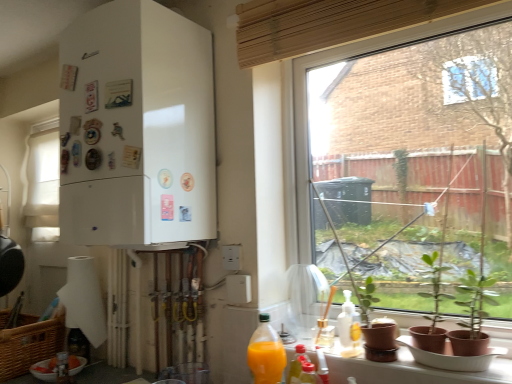
You are a GUI agent. You are given a task and a screenshot of the screen. Output one action in this format:
    pyautogui.click(x=<x>, y=<y>)
    Task: Click on the transparent glass window at center, which is counted as the first window, starting from the right
    
    Given the screenshot: What is the action you would take?
    pyautogui.click(x=409, y=153)

The image size is (512, 384). In order to click on translucent plastic bottle at lower center, the second bottle in the back-to-front sequence in this screenshot , I will do `click(297, 364)`.

Where is `white matte refrigerator at left`? This screenshot has height=384, width=512. white matte refrigerator at left is located at coordinates (136, 128).

The width and height of the screenshot is (512, 384). I want to click on matte brown pots at lower right, so click(411, 371).

Is white fabric curtain at left, which is the 2th window in front-to-back order, taller than transparent glass window at center, the 2th window in the back-to-front sequence?

In fact, white fabric curtain at left, which is the 2th window in front-to-back order, may be shorter than transparent glass window at center, the 2th window in the back-to-front sequence.

Is white fabric curtain at left, the 2th window when ordered from right to left, turned away from transparent glass window at center, the 2th window in the back-to-front sequence?

white fabric curtain at left, the 2th window when ordered from right to left, does not have its back to transparent glass window at center, the 2th window in the back-to-front sequence.

Which object is positioned more to the right, white fabric curtain at left, the 2th window when ordered from right to left, or transparent glass window at center, the 2th window in the back-to-front sequence?

transparent glass window at center, the 2th window in the back-to-front sequence, is more to the right.

In the image, is green matte plant at lower right positioned in front of or behind translucent plastic bottle at lower center, the 3th bottle in the left-to-right sequence?

green matte plant at lower right is in front of translucent plastic bottle at lower center, the 3th bottle in the left-to-right sequence.

Consider the image. Can you confirm if green matte plant at lower right is positioned to the left of translucent plastic bottle at lower center, the third bottle positioned from the front?

No.

Does green matte plant at lower right have a smaller size compared to translucent plastic bottle at lower center, the second bottle in the back-to-front sequence?

No.

Which is more to the right, translucent plastic bottle at lower center, the third bottle positioned from the front, or transparent glass window at center, which is counted as the first window, starting from the right?

transparent glass window at center, which is counted as the first window, starting from the right, is more to the right.

Based on the photo, from a real-world perspective, between translucent plastic bottle at lower center, the 2th bottle when ordered from right to left, and transparent glass window at center, the 2th window in the back-to-front sequence, who is vertically higher?

transparent glass window at center, the 2th window in the back-to-front sequence, is physically above.

Considering the sizes of objects translucent plastic bottle at lower center, the 2th bottle when ordered from right to left, and transparent glass window at center, the 2th window in the back-to-front sequence, in the image provided, who is taller, translucent plastic bottle at lower center, the 2th bottle when ordered from right to left, or transparent glass window at center, the 2th window in the back-to-front sequence,?

transparent glass window at center, the 2th window in the back-to-front sequence, is taller.

Do you think translucent plastic bottle at lower center, the 2th bottle when ordered from right to left, is within transparent glass window at center, which is counted as the first window, starting from the right, or outside of it?

translucent plastic bottle at lower center, the 2th bottle when ordered from right to left, is located beyond the bounds of transparent glass window at center, which is counted as the first window, starting from the right.

Is point (259, 329) farther from viewer compared to point (69, 381)?

No, it is not.

Which of these two, translucent orange juice at lower right, which is the 2th bottle in left-to-right order, or translucent plastic bottle at lower left, which is counted as the 4th bottle, starting from the front, stands taller?

With more height is translucent orange juice at lower right, which is the 2th bottle in left-to-right order.

Between translucent orange juice at lower right, the third bottle positioned from the right, and translucent plastic bottle at lower left, the 1th bottle positioned from the left, which one has larger size?

Bigger between the two is translucent orange juice at lower right, the third bottle positioned from the right.

How many degrees apart are the facing directions of translucent orange juice at lower right, which is the 2th bottle in left-to-right order, and translucent plastic bottle at lower left, which is counted as the 4th bottle, starting from the front?

The angle between the facing direction of translucent orange juice at lower right, which is the 2th bottle in left-to-right order, and the facing direction of translucent plastic bottle at lower left, which is counted as the 4th bottle, starting from the front, is 86.7 degrees.

Does white matte bowl at lower left contain translucent orange juice at lower right, arranged as the 2th bottle when viewed from the front?

No.

Does point (45, 368) come in front of point (282, 352)?

No.

Is white matte bowl at lower left next to translucent orange juice at lower right, arranged as the 2th bottle when viewed from the front, and touching it?

No, white matte bowl at lower left is not making contact with translucent orange juice at lower right, arranged as the 2th bottle when viewed from the front.

From a real-world perspective, who is located higher, translucent orange juice at lower right, the third bottle positioned from the right, or translucent plastic bottle at lower right, positioned as the 1th bottle in front-to-back order?

From a 3D spatial view, translucent orange juice at lower right, the third bottle positioned from the right, is above.

Is translucent orange juice at lower right, which is the 2th bottle in left-to-right order, far away from translucent plastic bottle at lower right, which appears as the 4th bottle when viewed from the left?

That's not correct — translucent orange juice at lower right, which is the 2th bottle in left-to-right order, is a little close to translucent plastic bottle at lower right, which appears as the 4th bottle when viewed from the left.

From the image's perspective, which object appears higher, translucent orange juice at lower right, which is the 2th bottle in left-to-right order, or translucent plastic bottle at lower right, the 1th bottle when ordered from right to left?

translucent orange juice at lower right, which is the 2th bottle in left-to-right order, is shown above in the image.

Is translucent plastic bottle at lower right, positioned as the 1th bottle in front-to-back order, at the back of translucent orange juice at lower right, arranged as the third bottle when viewed from the back?

Correct, translucent orange juice at lower right, arranged as the third bottle when viewed from the back, is looking away from translucent plastic bottle at lower right, positioned as the 1th bottle in front-to-back order.

Is matte brown pots at lower right to the left or to the right of woven brown picnic basket at lower left in the image?

matte brown pots at lower right is positioned on woven brown picnic basket at lower left's right side.

Can woven brown picnic basket at lower left be found inside matte brown pots at lower right?

No, woven brown picnic basket at lower left is not surrounded by matte brown pots at lower right.

Which object is wider, matte brown pots at lower right or woven brown picnic basket at lower left?

woven brown picnic basket at lower left.

Considering the sizes of matte brown pots at lower right and woven brown picnic basket at lower left in the image, is matte brown pots at lower right taller or shorter than woven brown picnic basket at lower left?

Considering their sizes, matte brown pots at lower right has less height than woven brown picnic basket at lower left.

Find the location of a particular element. window lying above the white fabric curtain at left, which is the 2th window in front-to-back order (from the image's perspective) is located at coordinates (409, 153).

Identify the location of the 2nd bottle counting from the left of the green matte plant at lower right. This screenshot has width=512, height=384. (297, 364).

Which object lies nearer to the anchor point woven brown picnic basket at lower left, white fabric curtain at left, the first window from the left, or green matte plant at lower right?

Among the two, white fabric curtain at left, the first window from the left, is located nearer to woven brown picnic basket at lower left.

Considering their positions, is translucent plastic bottle at lower left, the fourth bottle positioned from the right, positioned further to translucent orange juice at lower right, the third bottle positioned from the right, than white matte bowl at lower left?

The object further to translucent orange juice at lower right, the third bottle positioned from the right, is white matte bowl at lower left.

From the image, which object appears to be farther from transparent glass window at center, which is counted as the 1th window, starting from the front, translucent plastic bottle at lower right, the fourth bottle in the back-to-front sequence, or white matte refrigerator at left?

The object further to transparent glass window at center, which is counted as the 1th window, starting from the front, is translucent plastic bottle at lower right, the fourth bottle in the back-to-front sequence.

Which object lies further to the anchor point translucent plastic bottle at lower center, the 2th bottle when ordered from right to left, matte brown pots at lower right or green matte plant at lower right?

Based on the image, green matte plant at lower right appears to be further to translucent plastic bottle at lower center, the 2th bottle when ordered from right to left.

Which object lies nearer to the anchor point matte brown pots at lower right, translucent orange juice at lower right, the third bottle positioned from the right, or white matte refrigerator at left?

translucent orange juice at lower right, the third bottle positioned from the right, is closer to matte brown pots at lower right.

Consider the image. When comparing their distances from translucent orange juice at lower right, which is the 2th bottle in left-to-right order, does green matte plant at lower right or transparent glass window at center, which is counted as the first window, starting from the right, seem closer?

The object closer to translucent orange juice at lower right, which is the 2th bottle in left-to-right order, is green matte plant at lower right.

In the scene shown: Which object lies nearer to the anchor point transparent glass window at center, the 2th window in the back-to-front sequence, white matte refrigerator at left or matte brown pots at lower right?

matte brown pots at lower right is positioned closer to the anchor transparent glass window at center, the 2th window in the back-to-front sequence.

Which object lies nearer to the anchor point translucent orange juice at lower right, arranged as the 2th bottle when viewed from the front, translucent plastic bottle at lower left, the fourth bottle positioned from the right, or white matte refrigerator at left?

Among the two, white matte refrigerator at left is located nearer to translucent orange juice at lower right, arranged as the 2th bottle when viewed from the front.

Find the location of a particular element. This screenshot has height=384, width=512. window sill between white matte refrigerator at left and transparent glass window at center, the 2th window in the back-to-front sequence is located at coordinates click(411, 371).

Where is `houseplant between white matte refrigerator at left and matte brown pots at lower right from left to right`? The height and width of the screenshot is (384, 512). houseplant between white matte refrigerator at left and matte brown pots at lower right from left to right is located at coordinates (376, 328).

This screenshot has width=512, height=384. Identify the location of refrigerator between translucent plastic bottle at lower left, the fourth bottle positioned from the right, and transparent glass window at center, the 2th window from the left, in the horizontal direction. (136, 128).

Find the location of `houseplant between transparent glass window at center, which is counted as the 1th window, starting from the front, and translucent plastic bottle at lower center, the 3th bottle in the left-to-right sequence, vertically`. houseplant between transparent glass window at center, which is counted as the 1th window, starting from the front, and translucent plastic bottle at lower center, the 3th bottle in the left-to-right sequence, vertically is located at coordinates (376, 328).